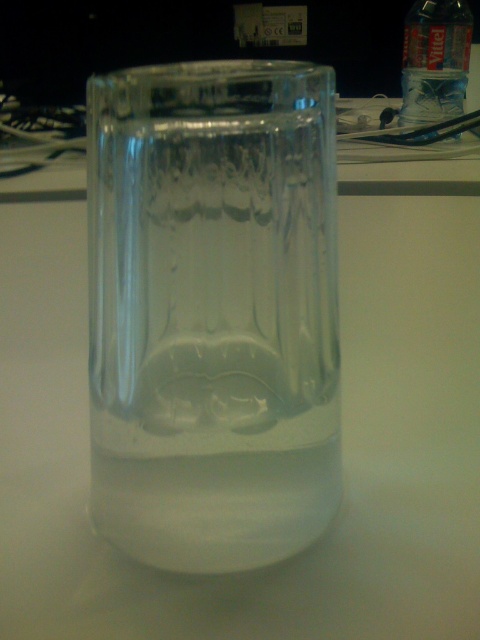
Question: Is transparent glass vase at center bigger than transparent plastic bottle at upper right?

Choices:
 (A) yes
 (B) no

Answer: (B)

Question: Which object is farther from the camera taking this photo?

Choices:
 (A) transparent glass vase at center
 (B) transparent plastic bottle at upper right

Answer: (B)

Question: Does transparent glass vase at center have a larger size compared to transparent plastic bottle at upper right?

Choices:
 (A) yes
 (B) no

Answer: (B)

Question: Does transparent glass vase at center have a greater width compared to transparent plastic bottle at upper right?

Choices:
 (A) yes
 (B) no

Answer: (B)

Question: Which of the following is the closest to the observer?

Choices:
 (A) transparent plastic bottle at upper right
 (B) transparent glass vase at center

Answer: (B)